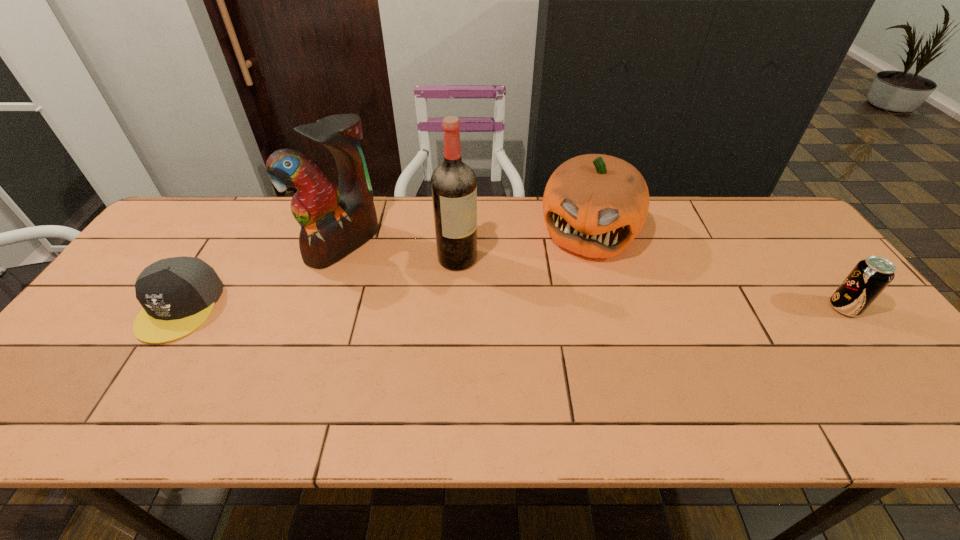
Locate an element on the screen. The width and height of the screenshot is (960, 540). cap is located at coordinates (178, 294).

Find the location of a particular element. This screenshot has height=540, width=960. the shortest object is located at coordinates [178, 294].

Image resolution: width=960 pixels, height=540 pixels. I want to click on the rightmost object, so click(867, 280).

In order to click on soda can in this screenshot , I will do `click(867, 280)`.

The width and height of the screenshot is (960, 540). I want to click on the third tallest object, so click(594, 205).

Find the location of a particular element. pumpkin is located at coordinates (594, 205).

Locate an element on the screen. This screenshot has width=960, height=540. liquor is located at coordinates (454, 184).

This screenshot has width=960, height=540. Identify the location of the fourth shortest object. (334, 221).

The height and width of the screenshot is (540, 960). In order to click on the fourth object from right to left in this screenshot , I will do `click(334, 221)`.

Find the location of a particular element. This screenshot has height=540, width=960. vacant region located 0.110m on the front-facing side of the cap is located at coordinates (131, 385).